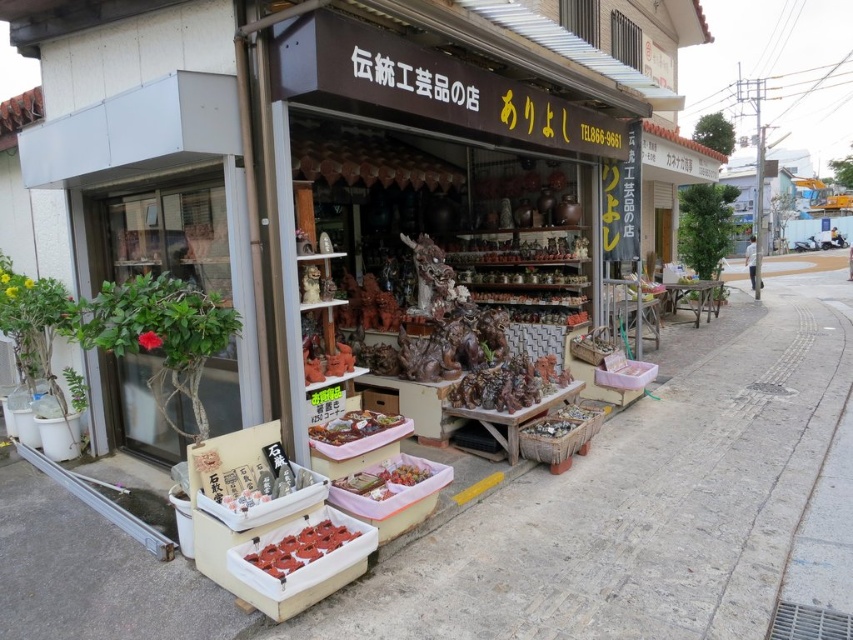
Can you confirm if smooth concrete pavement at lower center is taller than matte red donuts at lower center?

Indeed, smooth concrete pavement at lower center has a greater height compared to matte red donuts at lower center.

Can you confirm if smooth concrete pavement at lower center is smaller than matte red donuts at lower center?

Incorrect, smooth concrete pavement at lower center is not smaller in size than matte red donuts at lower center.

Describe the element at coordinates (643, 504) in the screenshot. Image resolution: width=853 pixels, height=640 pixels. I see `smooth concrete pavement at lower center` at that location.

Locate an element on the screen. smooth concrete pavement at lower center is located at coordinates (643, 504).

Is smooth concrete pavement at lower center smaller than green leafy plant at left?

Actually, smooth concrete pavement at lower center might be larger than green leafy plant at left.

Does point (761, 483) come farther from viewer compared to point (192, 262)?

Yes, point (761, 483) is behind point (192, 262).

Is point (780, 497) less distant than point (209, 362)?

No, (780, 497) is behind (209, 362).

Identify the location of smooth concrete pavement at lower center. (643, 504).

This screenshot has width=853, height=640. What do you see at coordinates (508, 385) in the screenshot? I see `brown wooden statue at center` at bounding box center [508, 385].

Can you confirm if brown wooden statue at center is smaller than shiny brown food at center?

Actually, brown wooden statue at center might be larger than shiny brown food at center.

Measure the distance between brown wooden statue at center and camera.

The distance of brown wooden statue at center from camera is 4.98 meters.

The image size is (853, 640). Find the location of `brown wooden statue at center`. brown wooden statue at center is located at coordinates (508, 385).